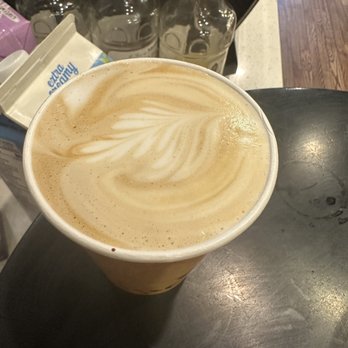
Locate an element on the screen. table is located at coordinates (191, 298).